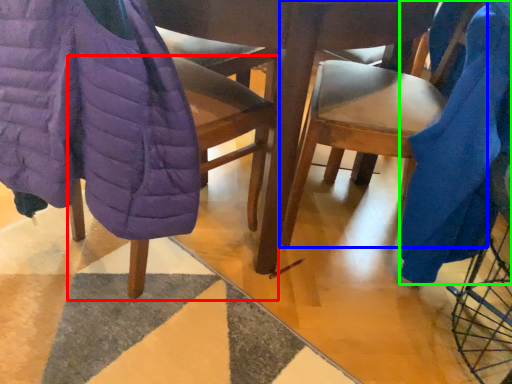
Question: Based on their relative distances, which object is farther from chair (highlighted by a red box)? Choose from chair (highlighted by a blue box) and blanket (highlighted by a green box).

Choices:
 (A) chair
 (B) blanket

Answer: (B)